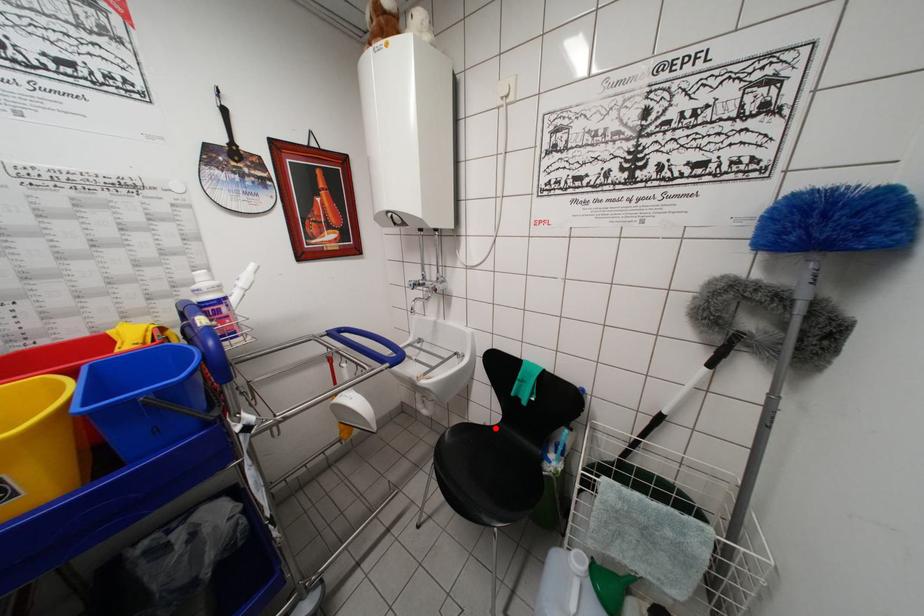
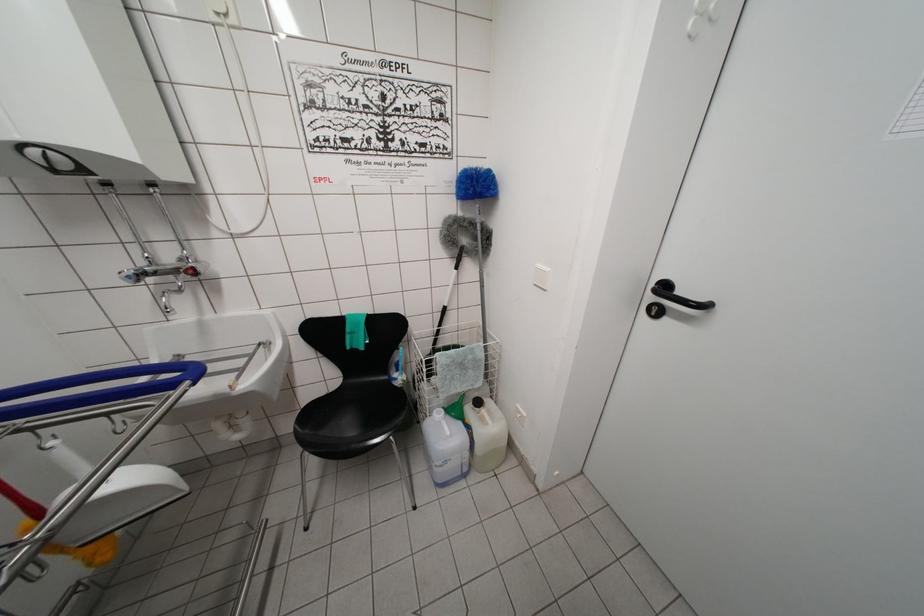
Question: A red point is marked in image1. In image2, is the corresponding 3D point closer to the camera or farther? Reply with the corresponding letter.

Choices:
 (A) The corresponding 3D point is closer.
 (B) The corresponding 3D point is farther.

Answer: (B)